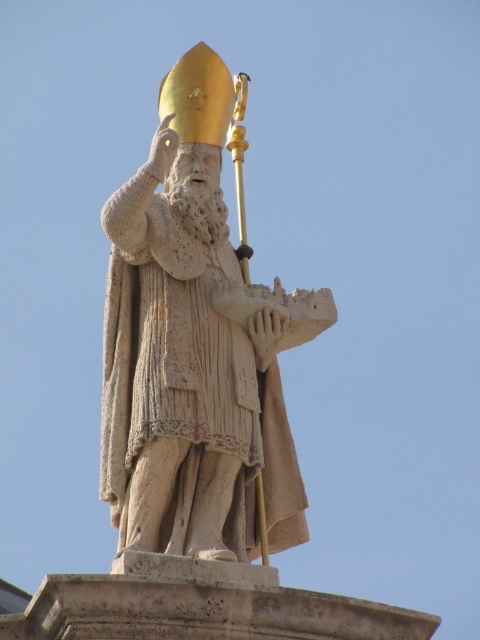
Does point (235, 298) come farther from viewer compared to point (194, 157)?

No, (235, 298) is in front of (194, 157).

Which is behind, point (176, 524) or point (192, 192)?

The point (192, 192) is more distant.

Where is `matte stone statue at center`? This screenshot has width=480, height=640. matte stone statue at center is located at coordinates 196,355.